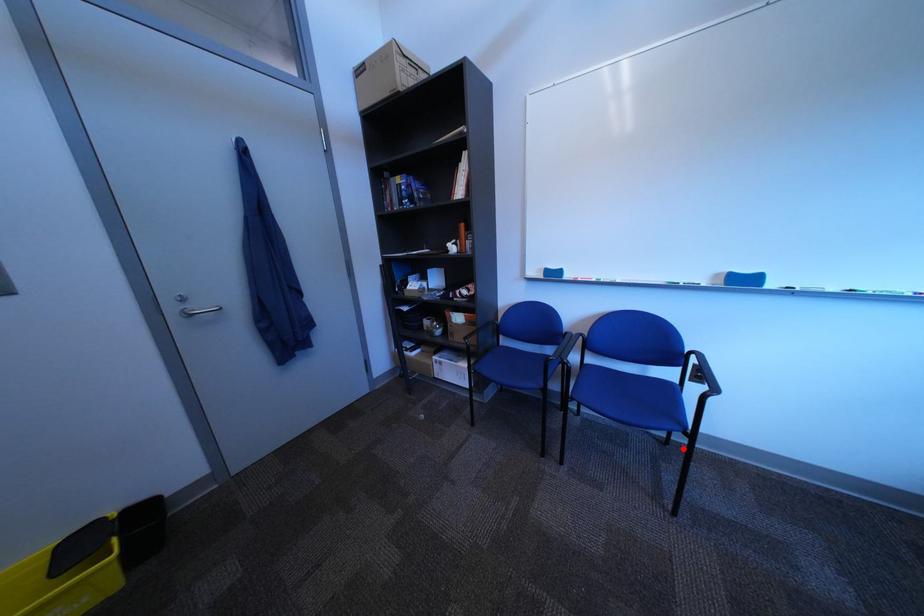
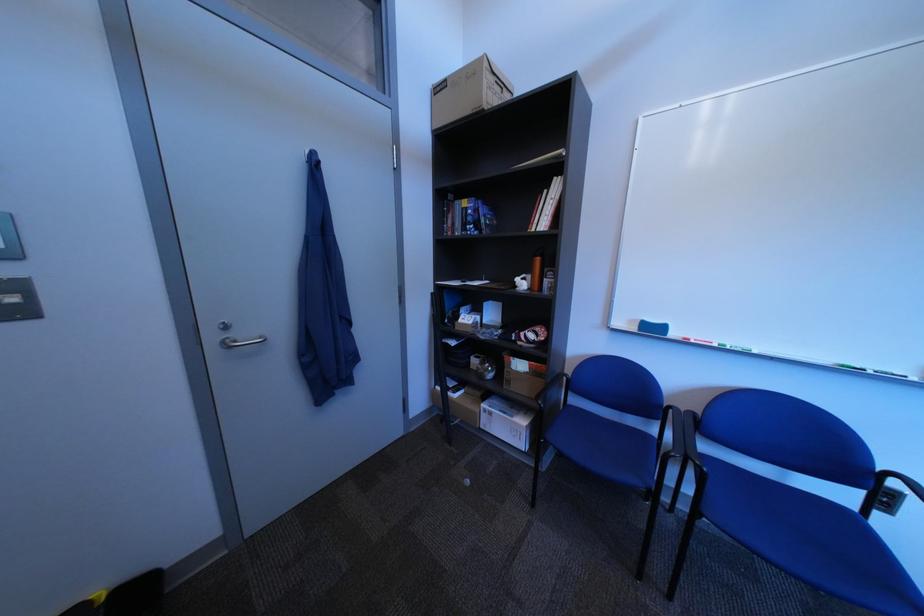
Question: I am providing you with two images of the same scene from different viewpoints. In image1, a red point is highlighted. Considering the same 3D point in image2, which of the following is correct?

Choices:
 (A) It is closer
 (B) It is farther

Answer: (A)